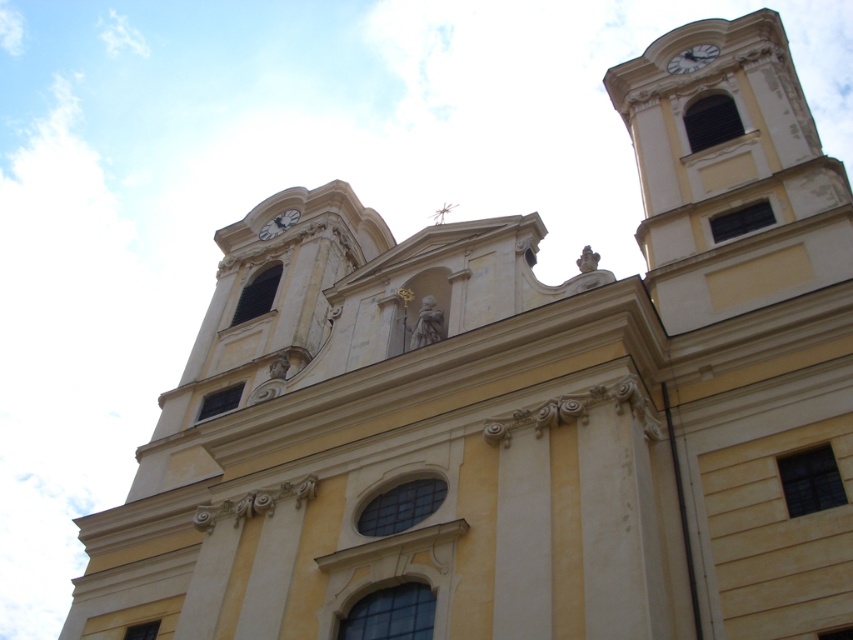
You are standing at the base of the architectural structure and want to take a photo that includes both the white glossy clock at upper right and the white glossy clock at upper center. Considering their distance apart, will you need to zoom in or zoom out to capture both in the same frame?

The white glossy clock at upper right is 39.67 meters away from the white glossy clock at upper center. To capture both in the same frame, you would need to zoom out to widen the field of view, as they are relatively far apart.

You are an architect examining the building facade. You notice the white glossy clock at upper right and the white glossy clock at upper center. Which clock is shorter in height?

The white glossy clock at upper right is shorter than the white glossy clock at upper center.